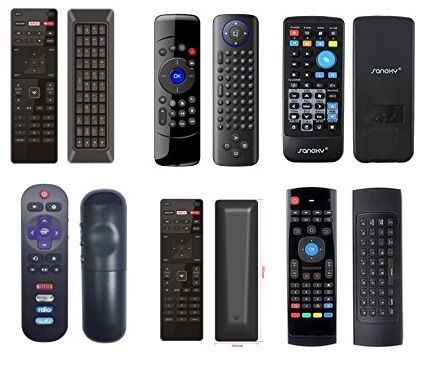
The height and width of the screenshot is (365, 425). I want to click on back of remote controls, so [85, 104], [244, 108], [401, 99], [388, 253], [243, 264], [98, 263].